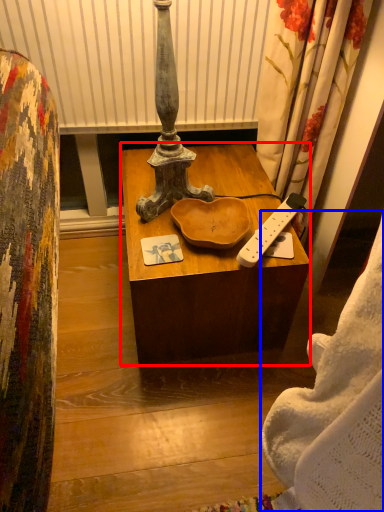
Question: Which object is closer to the camera taking this photo, desk (highlighted by a red box) or blanket (highlighted by a blue box)?

Choices:
 (A) desk
 (B) blanket

Answer: (B)